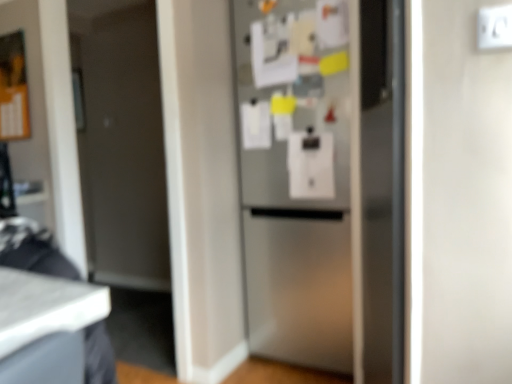
You are a GUI agent. You are given a task and a screenshot of the screen. Output one action in this format:
    pyautogui.click(x=<x>, y=<y>)
    Task: Click on the satin silver refrigerator at center
    
    Given the screenshot: What is the action you would take?
    pyautogui.click(x=322, y=181)

Describe the element at coordinates (322, 181) in the screenshot. I see `satin silver refrigerator at center` at that location.

Describe the element at coordinates (494, 27) in the screenshot. I see `white plastic electric outlet at upper right` at that location.

Find the location of `white plastic electric outlet at upper right`. white plastic electric outlet at upper right is located at coordinates (494, 27).

Measure the distance between white plastic electric outlet at upper right and camera.

The distance of white plastic electric outlet at upper right from camera is 35.72 inches.

The width and height of the screenshot is (512, 384). I want to click on satin silver refrigerator at center, so pos(322,181).

Is satin silver refrigerator at center at the right side of white plastic electric outlet at upper right?

No, satin silver refrigerator at center is not to the right of white plastic electric outlet at upper right.

Is satin silver refrigerator at center in front of or behind white plastic electric outlet at upper right in the image?

In the image, satin silver refrigerator at center appears behind white plastic electric outlet at upper right.

Does point (283, 195) come behind point (489, 28)?

Yes, it is behind point (489, 28).

From the image's perspective, is satin silver refrigerator at center on top of white plastic electric outlet at upper right?

No, from the image's perspective, satin silver refrigerator at center is not over white plastic electric outlet at upper right.

From a real-world perspective, who is located higher, satin silver refrigerator at center or white plastic electric outlet at upper right?

In real-world perspective, white plastic electric outlet at upper right is above.

In terms of width, does satin silver refrigerator at center look wider or thinner when compared to white plastic electric outlet at upper right?

Considering their sizes, satin silver refrigerator at center looks broader than white plastic electric outlet at upper right.

Does satin silver refrigerator at center have a greater height compared to white plastic electric outlet at upper right?

Correct, satin silver refrigerator at center is much taller as white plastic electric outlet at upper right.

Which of these two, satin silver refrigerator at center or white plastic electric outlet at upper right, is bigger?

satin silver refrigerator at center.

Is satin silver refrigerator at center outside of white plastic electric outlet at upper right?

Indeed, satin silver refrigerator at center is completely outside white plastic electric outlet at upper right.

Would you say satin silver refrigerator at center is a long distance from white plastic electric outlet at upper right?

Indeed, satin silver refrigerator at center is not near white plastic electric outlet at upper right.

Is white plastic electric outlet at upper right at the back of satin silver refrigerator at center?

No.

How many degrees apart are the facing directions of satin silver refrigerator at center and white plastic electric outlet at upper right?

The facing directions of satin silver refrigerator at center and white plastic electric outlet at upper right are 0.728 degrees apart.

Could you measure the distance between satin silver refrigerator at center and white plastic electric outlet at upper right?

A distance of 3.36 feet exists between satin silver refrigerator at center and white plastic electric outlet at upper right.

Locate an element on the screen. refrigerator that appears below the white plastic electric outlet at upper right (from a real-world perspective) is located at coordinates (322, 181).

Consider the image. Considering the relative positions of white plastic electric outlet at upper right and satin silver refrigerator at center in the image provided, is white plastic electric outlet at upper right to the right of satin silver refrigerator at center from the viewer's perspective?

Indeed, white plastic electric outlet at upper right is positioned on the right side of satin silver refrigerator at center.

Between white plastic electric outlet at upper right and satin silver refrigerator at center, which one is positioned in front?

white plastic electric outlet at upper right is in front.

Is point (496, 24) closer or farther from the camera than point (317, 109)?

Point (496, 24) appears to be closer to the viewer than point (317, 109).

From the image's perspective, is white plastic electric outlet at upper right positioned above or below satin silver refrigerator at center?

Based on their image positions, white plastic electric outlet at upper right is located above satin silver refrigerator at center.

Consider the image. From a real-world perspective, which is physically above, white plastic electric outlet at upper right or satin silver refrigerator at center?

In real-world perspective, white plastic electric outlet at upper right is above.

Does white plastic electric outlet at upper right have a greater width compared to satin silver refrigerator at center?

In fact, white plastic electric outlet at upper right might be narrower than satin silver refrigerator at center.

Between white plastic electric outlet at upper right and satin silver refrigerator at center, which one has more height?

With more height is satin silver refrigerator at center.

Can you confirm if white plastic electric outlet at upper right is bigger than satin silver refrigerator at center?

No.

Which is correct: white plastic electric outlet at upper right is inside satin silver refrigerator at center, or outside of it?

white plastic electric outlet at upper right is not enclosed by satin silver refrigerator at center.

Are white plastic electric outlet at upper right and satin silver refrigerator at center located far from each other?

Yes, white plastic electric outlet at upper right is far from satin silver refrigerator at center.

Is white plastic electric outlet at upper right looking in the opposite direction of satin silver refrigerator at center?

That's not correct — white plastic electric outlet at upper right is not looking away from satin silver refrigerator at center.

How different are the orientations of white plastic electric outlet at upper right and satin silver refrigerator at center in degrees?

The angular difference between white plastic electric outlet at upper right and satin silver refrigerator at center is 0.728 degrees.

In the scene shown: Measure the distance from white plastic electric outlet at upper right to satin silver refrigerator at center.

white plastic electric outlet at upper right is 3.36 feet away from satin silver refrigerator at center.

Where is `refrigerator behind the white plastic electric outlet at upper right`? The height and width of the screenshot is (384, 512). refrigerator behind the white plastic electric outlet at upper right is located at coordinates (322, 181).

This screenshot has height=384, width=512. In order to click on electric outlet in front of the satin silver refrigerator at center in this screenshot , I will do `click(494, 27)`.

At what (x,y) coordinates should I click in order to perform the action: click on electric outlet above the satin silver refrigerator at center (from a real-world perspective). Please return your answer as a coordinate pair (x, y). The width and height of the screenshot is (512, 384). Looking at the image, I should click on (494, 27).